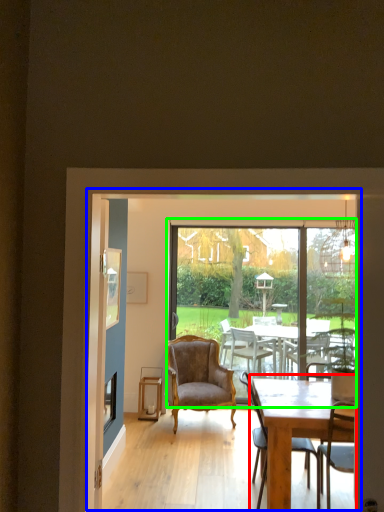
Question: Based on their relative distances, which object is nearer to round table (highlighted by a red box)? Choose from screen door (highlighted by a blue box) and window screen (highlighted by a green box).

Choices:
 (A) screen door
 (B) window screen

Answer: (A)